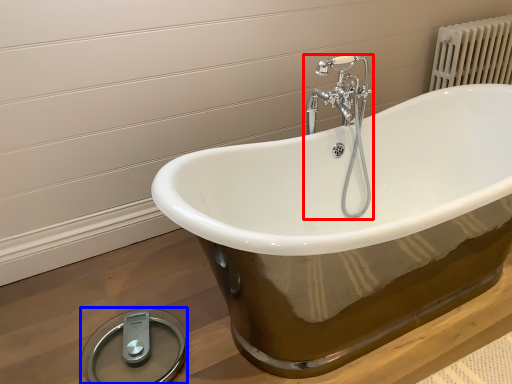
Question: Which object is closer to the camera taking this photo, tap (highlighted by a red box) or scale (highlighted by a blue box)?

Choices:
 (A) tap
 (B) scale

Answer: (B)